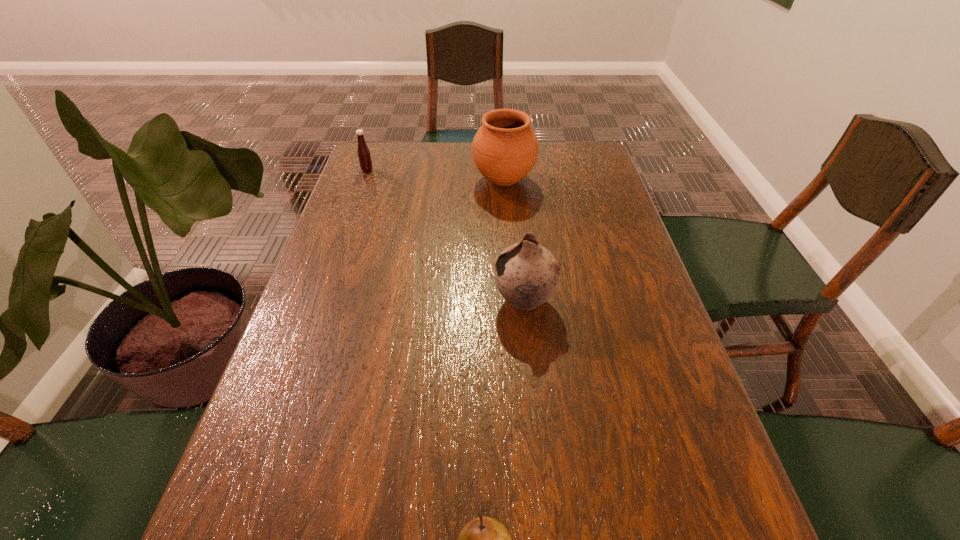
Locate an element on the screen. Image resolution: width=960 pixels, height=540 pixels. free space between the farther pottery and the second nearest object is located at coordinates (514, 240).

At what (x,y) coordinates should I click in order to perform the action: click on free space that is in between the third farthest object and the farther pottery. Please return your answer as a coordinate pair (x, y). Looking at the image, I should click on (514, 240).

I want to click on free spot between the leftmost object and the farther pottery, so click(x=435, y=175).

Image resolution: width=960 pixels, height=540 pixels. Identify the location of unoccupied area between the third tallest object and the farther pottery. (435, 175).

Where is `vacant space in between the Tabasco sauce and the second nearest object`? Image resolution: width=960 pixels, height=540 pixels. vacant space in between the Tabasco sauce and the second nearest object is located at coordinates (445, 235).

Locate an element on the screen. object that stands as the second closest to the third tallest object is located at coordinates (526, 274).

Identify which object is the third closest to the nearer pottery. Please provide its 2D coordinates. Your answer should be formatted as a tuple, i.e. [(x, y)], where the tuple contains the x and y coordinates of a point satisfying the conditions above.

[(363, 152)]